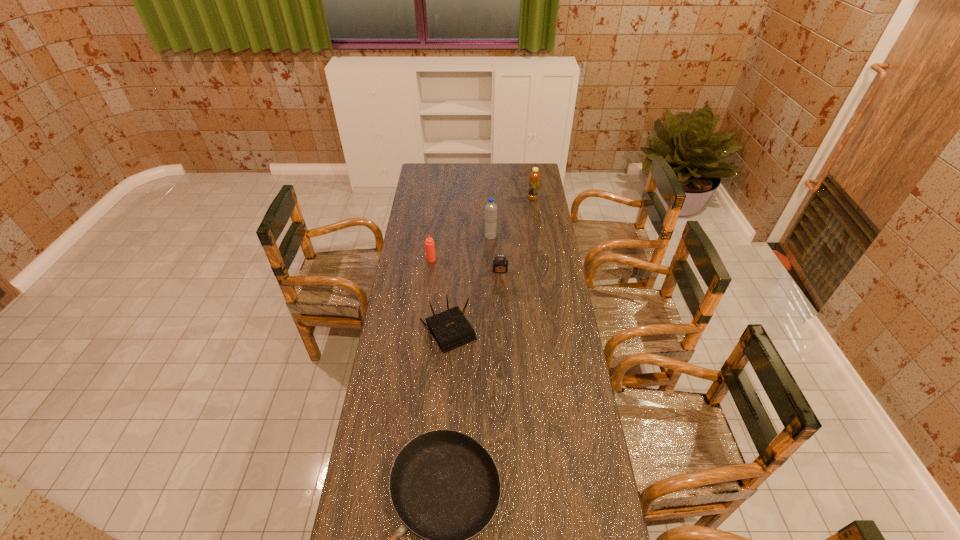
Locate an element on the screen. free space that is in between the fourth nearest object and the tallest object is located at coordinates (461, 248).

Where is `free point between the bottle and the third nearest object`? The height and width of the screenshot is (540, 960). free point between the bottle and the third nearest object is located at coordinates (516, 235).

I want to click on free space between the fourth nearest object and the router, so click(441, 295).

At what (x,y) coordinates should I click in order to perform the action: click on free space between the rightmost object and the fourth farthest object. Please return your answer as a coordinate pair (x, y). Looking at the image, I should click on (516, 235).

At what (x,y) coordinates should I click in order to perform the action: click on free space between the third farthest object and the rightmost object. Please return your answer as a coordinate pair (x, y). Image resolution: width=960 pixels, height=540 pixels. Looking at the image, I should click on (482, 229).

At what (x,y) coordinates should I click in order to perform the action: click on free space between the fourth farthest object and the water bottle. Please return your answer as a coordinate pair (x, y). Looking at the image, I should click on tap(495, 254).

The image size is (960, 540). Find the location of `vacant region between the padlock and the fifth shortest object`. vacant region between the padlock and the fifth shortest object is located at coordinates (516, 235).

Identify the location of object that is the fifth closest one to the water bottle. (445, 487).

Locate an element on the screen. This screenshot has height=540, width=960. object that stands as the closest to the fourth nearest object is located at coordinates (490, 208).

Find the location of a particular element. This screenshot has height=540, width=960. vacant point that satisfies the following two spatial constraints: 1. on the back side of the second farthest object; 2. on the left side of the bottle is located at coordinates (490, 199).